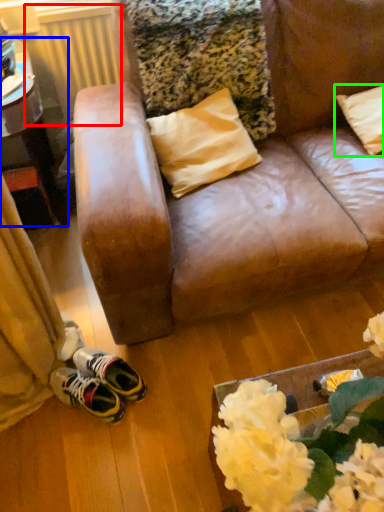
Question: Based on their relative distances, which object is nearer to radiator (highlighted by a red box)? Choose from table (highlighted by a blue box) and pillow (highlighted by a green box).

Choices:
 (A) table
 (B) pillow

Answer: (A)